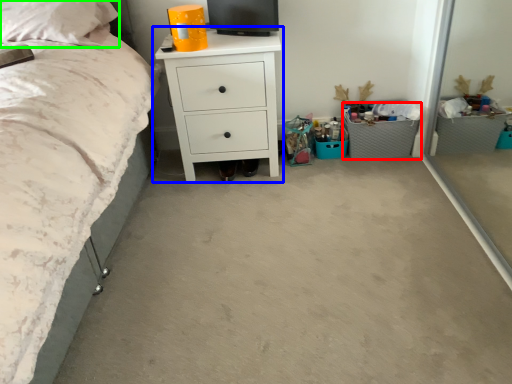
Question: Which object is the farthest from crate (highlighted by a red box)? Choose among these: chest of drawers (highlighted by a blue box) or pillow (highlighted by a green box).

Choices:
 (A) chest of drawers
 (B) pillow

Answer: (B)